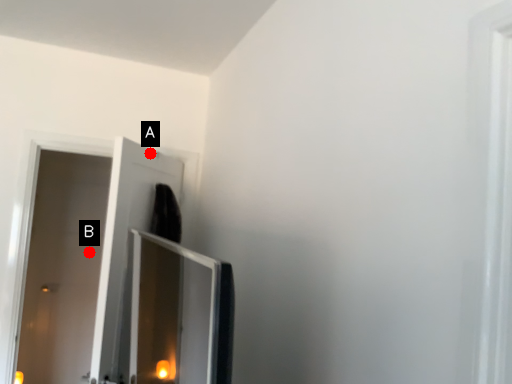
Question: Two points are circled on the image, labeled by A and B beside each circle. Among these points, which one is farthest from the camera?

Choices:
 (A) A is further
 (B) B is further

Answer: (B)